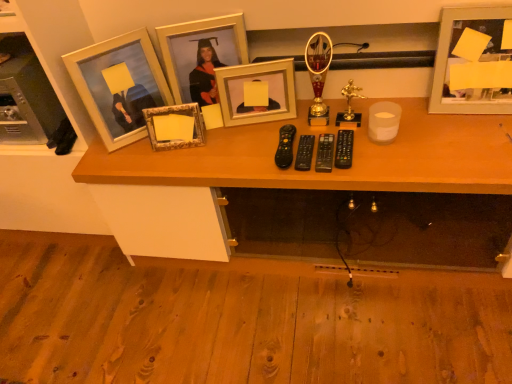
Question: Visually, is gold metallic picture frame at center, which is counted as the 4th picture frame, starting from the left, positioned to the left or to the right of wooden desk at center?

Choices:
 (A) right
 (B) left

Answer: (B)

Question: Is gold metallic picture frame at center, marked as the second picture frame in a right-to-left arrangement, spatially inside wooden desk at center, or outside of it?

Choices:
 (A) outside
 (B) inside

Answer: (A)

Question: Considering the real-world distances, which object is closest to the gold metallic picture frame at center, marked as the second picture frame in a right-to-left arrangement?

Choices:
 (A) gold textured photo frame at center, which is the fourth picture frame in right-to-left order
 (B) gold metallic picture frame at upper center, arranged as the 3th picture frame when viewed from the left
 (C) wooden desk at center
 (D) matte wooden picture frame at left, the 1th picture frame viewed from the left
 (E) metallic silver picture frame at upper right, the fifth picture frame in the left-to-right sequence

Answer: (B)

Question: Based on their relative distances, which object is nearer to the matte wooden picture frame at left, the fifth picture frame when ordered from right to left?

Choices:
 (A) gold textured photo frame at center, which is the fourth picture frame in right-to-left order
 (B) gold metallic picture frame at upper center, placed as the third picture frame when sorted from right to left
 (C) gold metallic picture frame at center, which is counted as the 4th picture frame, starting from the left
 (D) metallic silver picture frame at upper right, the first picture frame from the right
 (E) wooden desk at center

Answer: (A)